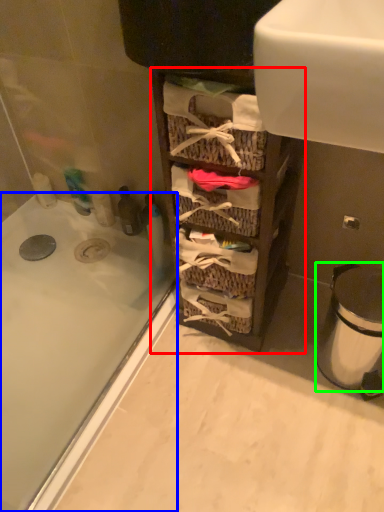
Question: Considering the real-world distances, which object is closest to cabinetry (highlighted by a red box)? bathtub (highlighted by a blue box) or trash bin/can (highlighted by a green box).

Choices:
 (A) bathtub
 (B) trash bin/can

Answer: (B)